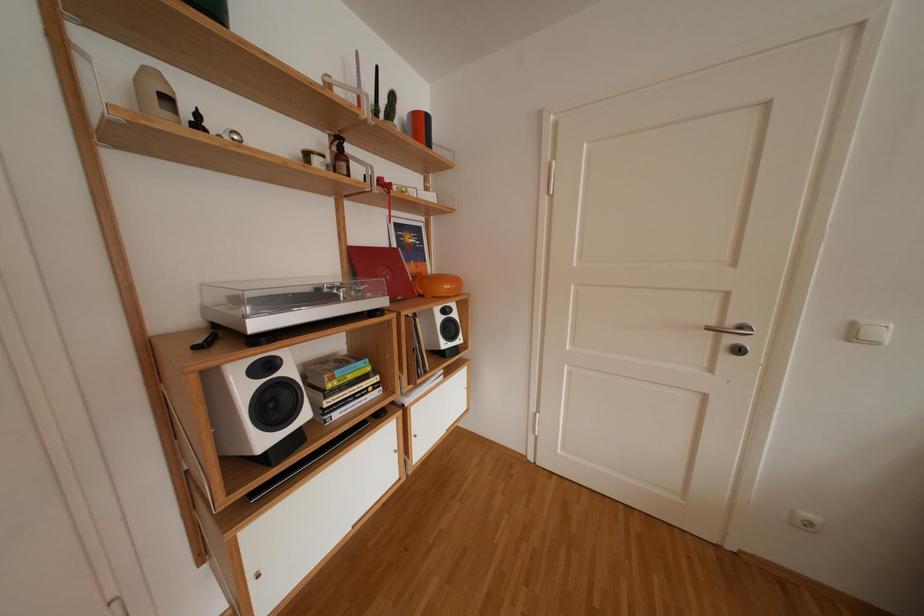
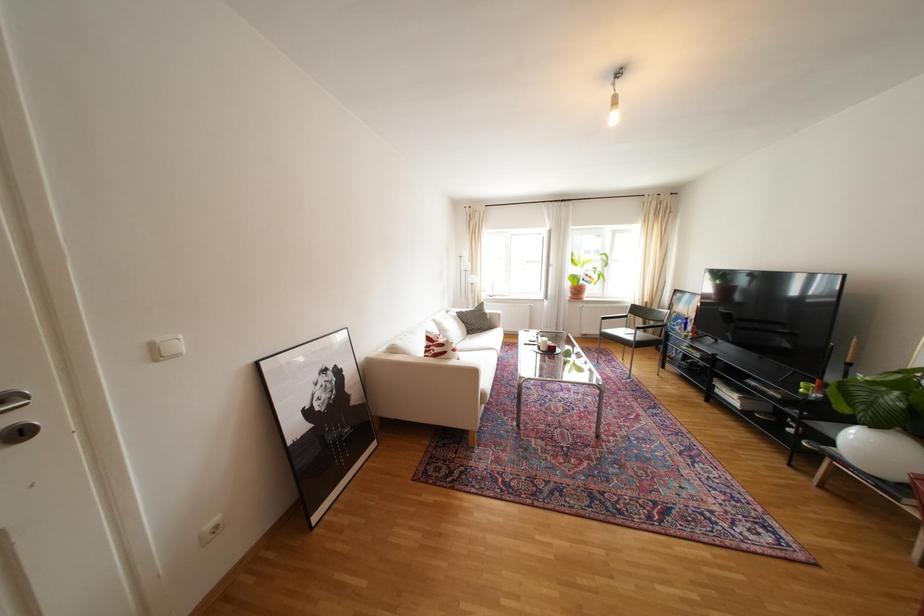
Question: The camera is either moving clockwise (left) or counter-clockwise (right) around the object. The first image is from the beginning of the video and the second image is from the end. Is the camera moving left or right when shooting the video?

Choices:
 (A) Left
 (B) Right

Answer: (A)